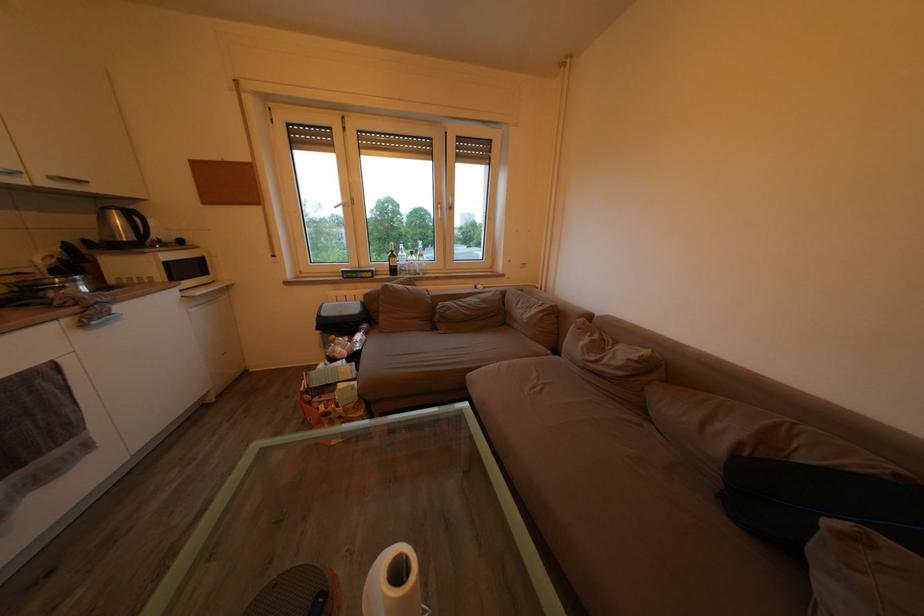
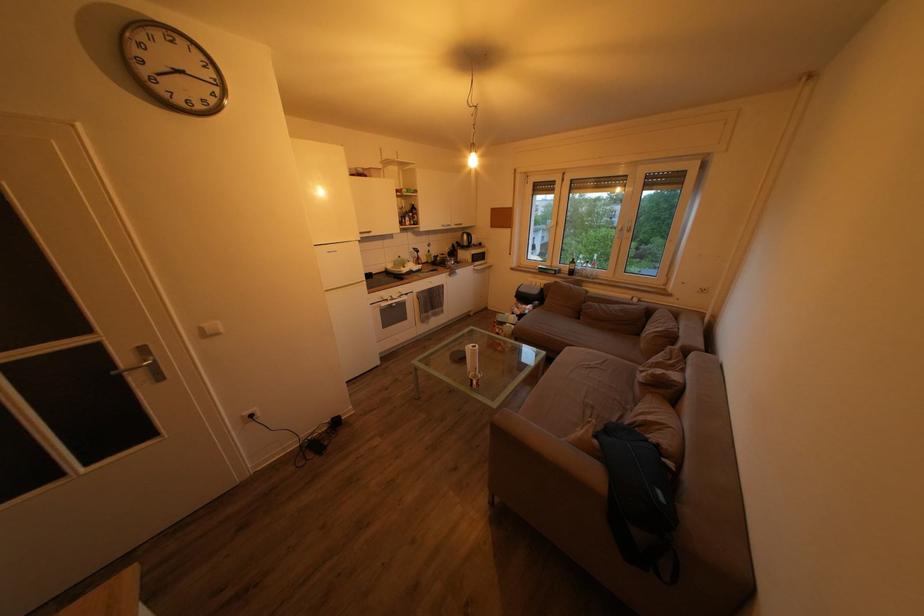
In the second image, find the point that corresponds to [54,188] in the first image.

(462, 233)